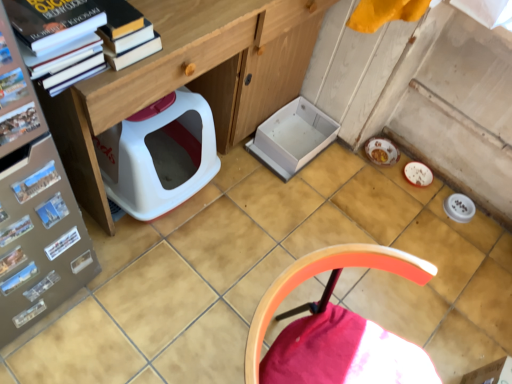
The height and width of the screenshot is (384, 512). Find the location of `free space in front of matte wood desk at center`. free space in front of matte wood desk at center is located at coordinates (173, 286).